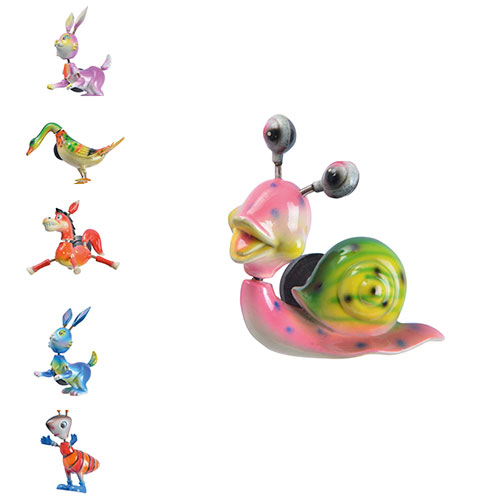
Find the location of a particular element. The image size is (500, 500). knick knacks is located at coordinates 71,474, 77,346, 68,237, 78,154, 86,60, 325,264.